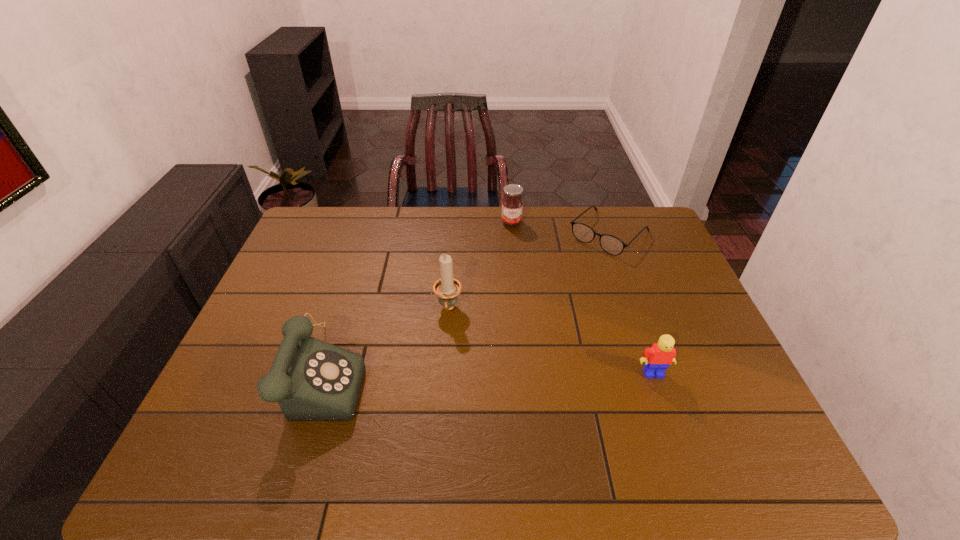
In order to click on blank region between the Lego and the jam in this screenshot , I will do `click(583, 298)`.

This screenshot has height=540, width=960. In order to click on empty space between the third object from left to right and the Lego in this screenshot , I will do `click(583, 298)`.

What are the coordinates of `object that can be found as the fourth closest to the third nearest object` in the screenshot? It's located at (657, 358).

Locate an element on the screen. Image resolution: width=960 pixels, height=540 pixels. object that ranks as the fourth closest to the second object from left to right is located at coordinates (657, 358).

This screenshot has height=540, width=960. I want to click on blank space that satisfies the following two spatial constraints: 1. on the front side of the spectacles; 2. on the left side of the third object from left to right, so click(513, 234).